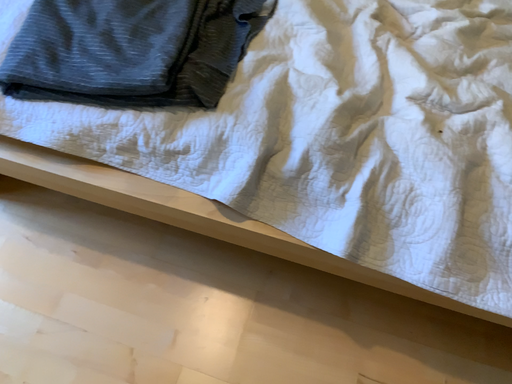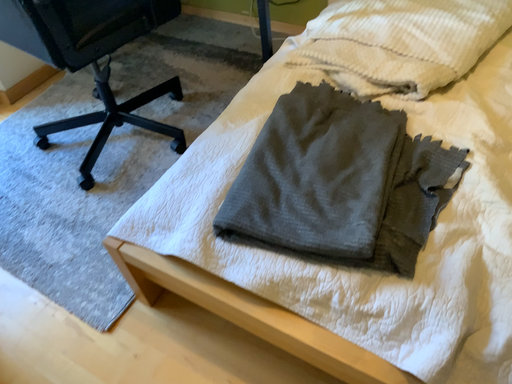
Question: How did the camera likely rotate when shooting the video?

Choices:
 (A) rotated right
 (B) rotated left

Answer: (B)